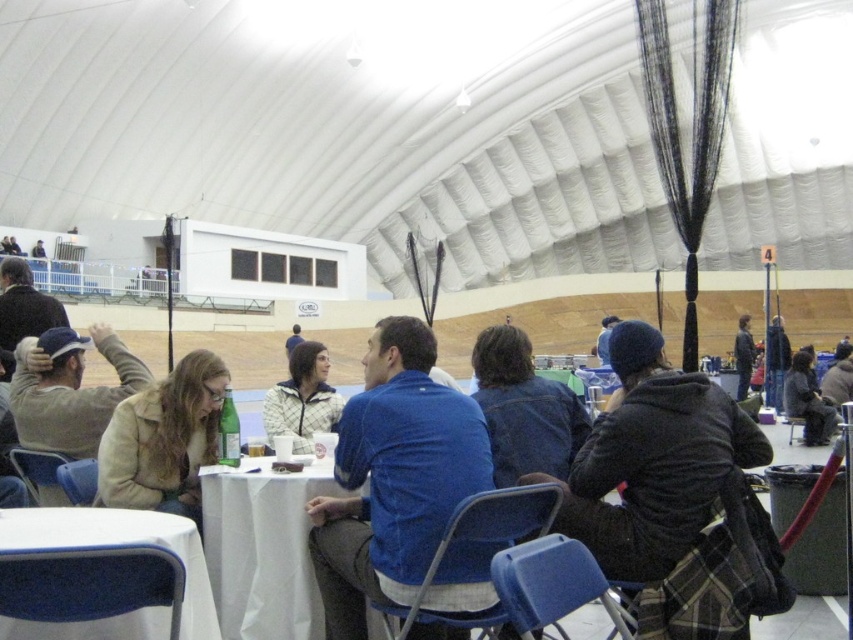
Question: Is white fabric table at lower left thinner than dark brown fur coat at lower right?

Choices:
 (A) no
 (B) yes

Answer: (A)

Question: Which point appears farthest from the camera in this image?

Choices:
 (A) (550, 387)
 (B) (757, 451)
 (C) (374, 630)

Answer: (A)

Question: Which point is closer to the camera taking this photo?

Choices:
 (A) [193, 616]
 (B) [477, 433]

Answer: (A)

Question: Does blue cotton shirt at center lie behind white quilted jacket at center?

Choices:
 (A) no
 (B) yes

Answer: (A)

Question: Estimate the real-world distances between objects in this image. Which object is closer to the dark blue knit hat at center?

Choices:
 (A) blue cotton shirt at center
 (B) white cloth table at center

Answer: (A)

Question: Is blue cotton shirt at center above dark blue jacket at center?

Choices:
 (A) yes
 (B) no

Answer: (B)